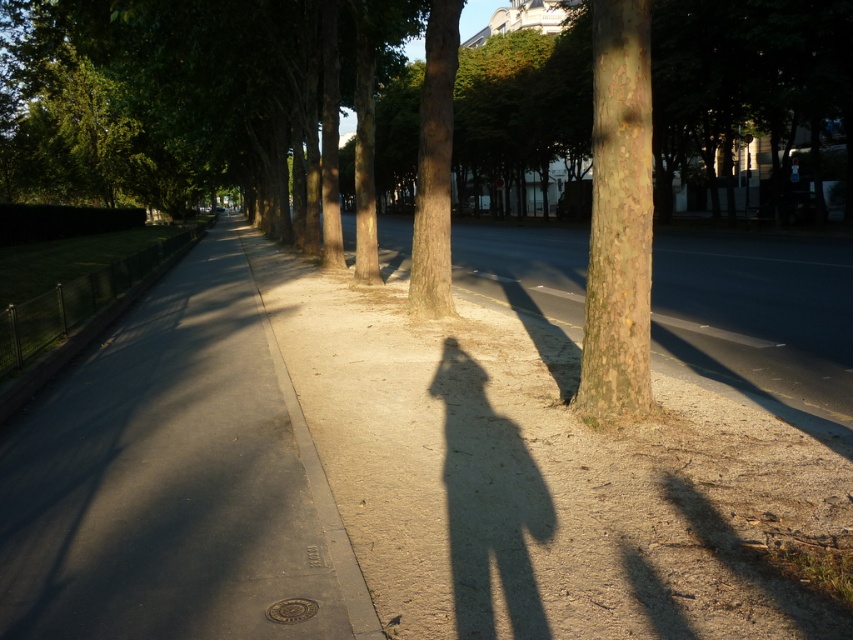
Question: Based on their relative distances, which object is nearer to the brown rough bark tree trunk at center?

Choices:
 (A) smooth brown bark at center
 (B) brown dirt sidewalk at center

Answer: (B)

Question: Where is brown dirt sidewalk at center located in relation to dark asphalt pavement at center in the image?

Choices:
 (A) left
 (B) right

Answer: (B)

Question: Which point is closer to the camera?

Choices:
 (A) dark asphalt pavement at center
 (B) brown rough bark tree trunk at center
 (C) smooth brown bark at center

Answer: (A)

Question: Estimate the real-world distances between objects in this image. Which object is closer to the brown dirt sidewalk at center?

Choices:
 (A) brown rough tree trunk at center
 (B) smooth brown bark at center
 (C) brown rough bark tree trunk at center
 (D) dark asphalt pavement at center

Answer: (D)

Question: Does dark asphalt pavement at center have a smaller size compared to brown rough bark tree trunk at center?

Choices:
 (A) yes
 (B) no

Answer: (B)

Question: Is brown dirt sidewalk at center bigger than brown rough bark tree trunk at center?

Choices:
 (A) yes
 (B) no

Answer: (A)